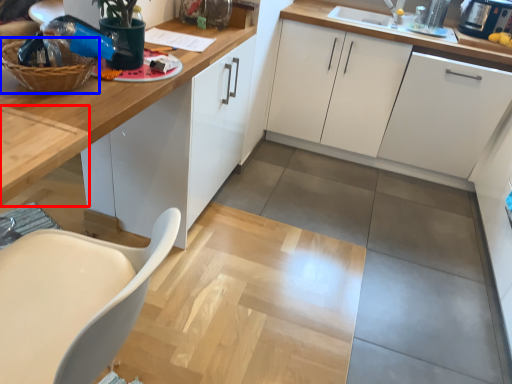
Question: Which object appears farthest to the camera in this image, table (highlighted by a red box) or basket (highlighted by a blue box)?

Choices:
 (A) table
 (B) basket

Answer: (B)